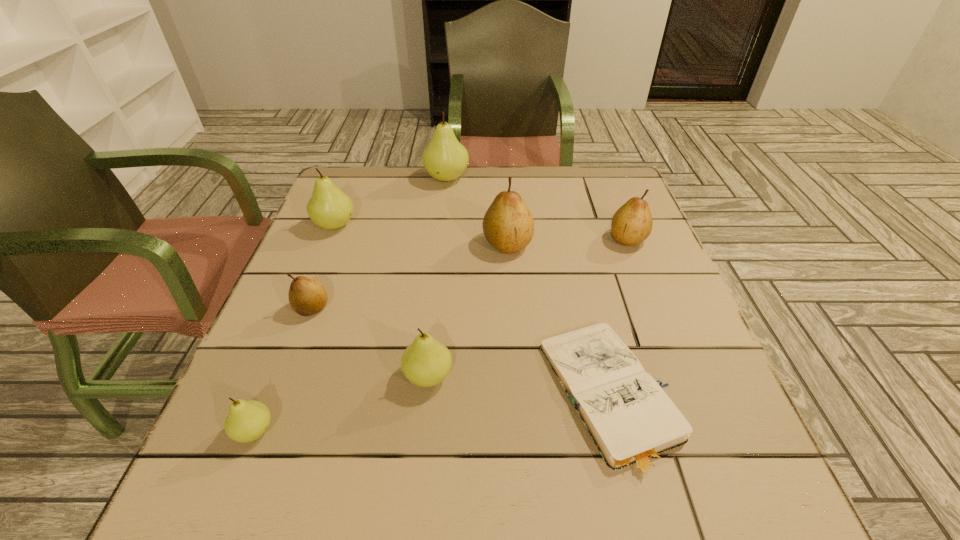
Where is `free space that satisfies the following two spatial constraints: 1. on the front side of the farthest object; 2. on the right side of the rightmost brown pear`? Image resolution: width=960 pixels, height=540 pixels. free space that satisfies the following two spatial constraints: 1. on the front side of the farthest object; 2. on the right side of the rightmost brown pear is located at coordinates (441, 239).